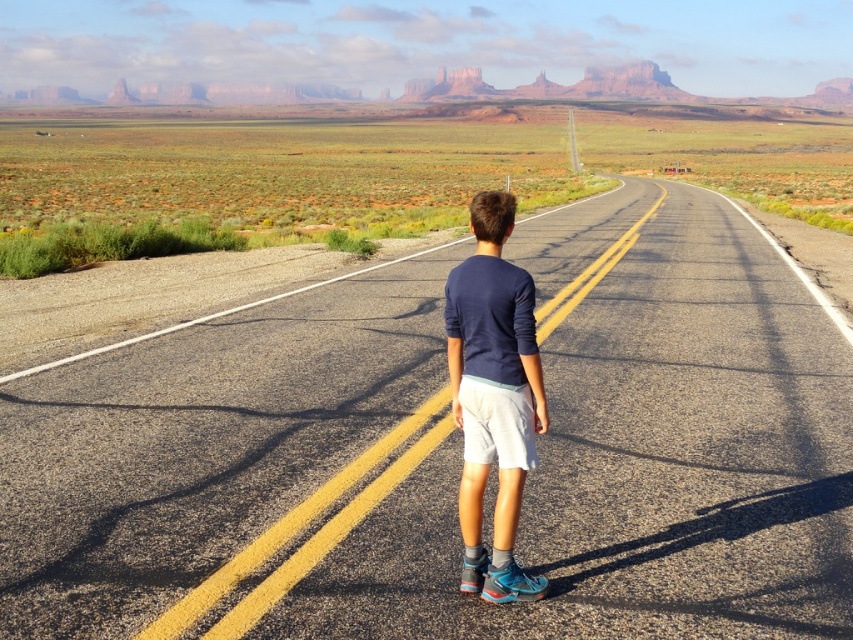
Question: Is asphalt road at center thinner than navy blue shirt at center?

Choices:
 (A) yes
 (B) no

Answer: (B)

Question: Which of the following is the farthest from the observer?

Choices:
 (A) (456, 285)
 (B) (386, 468)

Answer: (B)

Question: Does asphalt road at center have a greater width compared to navy blue shirt at center?

Choices:
 (A) yes
 (B) no

Answer: (A)

Question: Which point is farther from the camera taking this photo?

Choices:
 (A) (525, 346)
 (B) (105, 419)

Answer: (B)

Question: Among these objects, which one is farthest from the camera?

Choices:
 (A) asphalt road at center
 (B) navy blue shirt at center

Answer: (B)

Question: Is the position of asphalt road at center more distant than that of navy blue shirt at center?

Choices:
 (A) yes
 (B) no

Answer: (B)